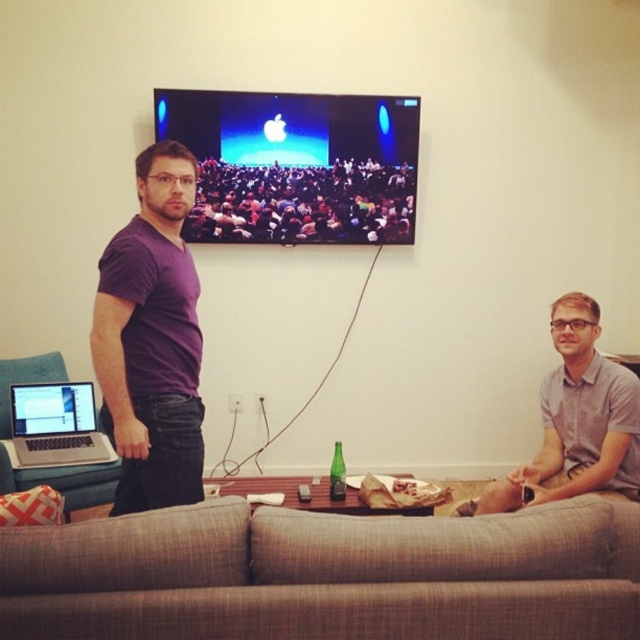
Question: Can you confirm if gray cotton shirt at lower right is positioned below gray fabric couch at lower left?

Choices:
 (A) no
 (B) yes

Answer: (A)

Question: Which of these objects is positioned closest to the gray cotton shirt at lower right?

Choices:
 (A) purple cotton t-shirt at left
 (B) matte silver laptop at left
 (C) matte black crowd at upper center
 (D) gray fabric couch at lower left

Answer: (A)

Question: Is textured beige couch at lower center above gray fabric couch at lower left?

Choices:
 (A) no
 (B) yes

Answer: (A)

Question: Which point appears closest to the camera in this image?

Choices:
 (A) (80, 385)
 (B) (161, 435)
 (C) (474, 534)

Answer: (C)

Question: Which of the following is the closest to the observer?

Choices:
 (A) (102, 460)
 (B) (74, 493)
 (C) (184, 488)

Answer: (C)

Question: Can you confirm if matte black crowd at upper center is positioned to the right of matte silver laptop at left?

Choices:
 (A) no
 (B) yes

Answer: (B)